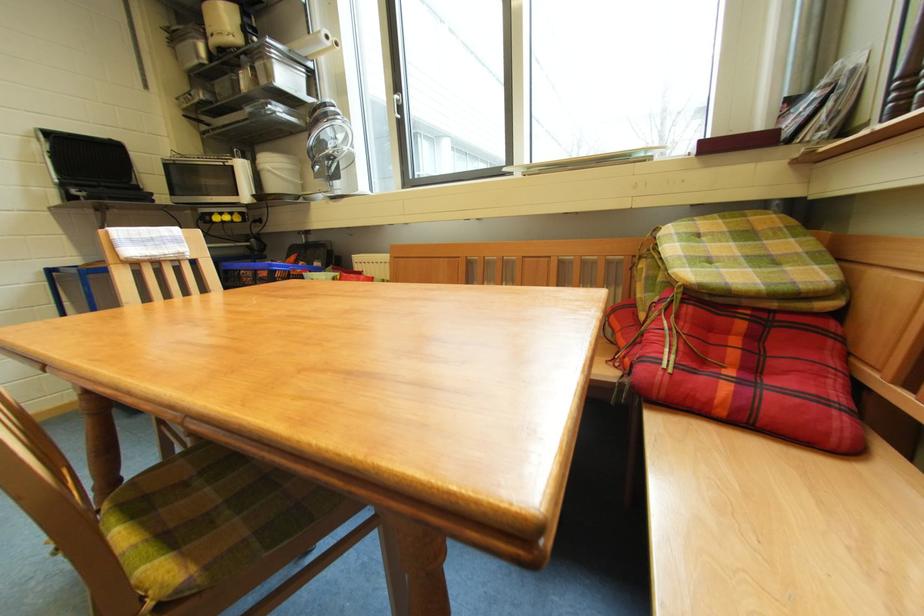
Find the location of a particular element. white window handle is located at coordinates (397, 103).